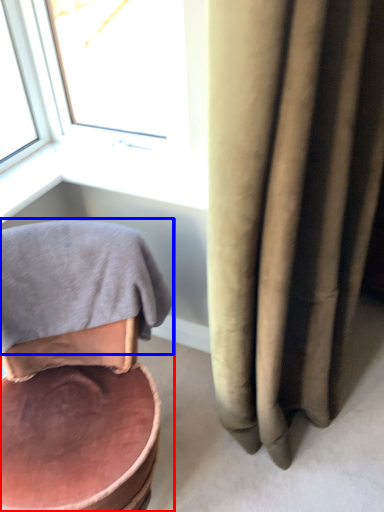
Question: Among these objects, which one is farthest to the camera, chair (highlighted by a red box) or bath towel (highlighted by a blue box)?

Choices:
 (A) chair
 (B) bath towel

Answer: (B)